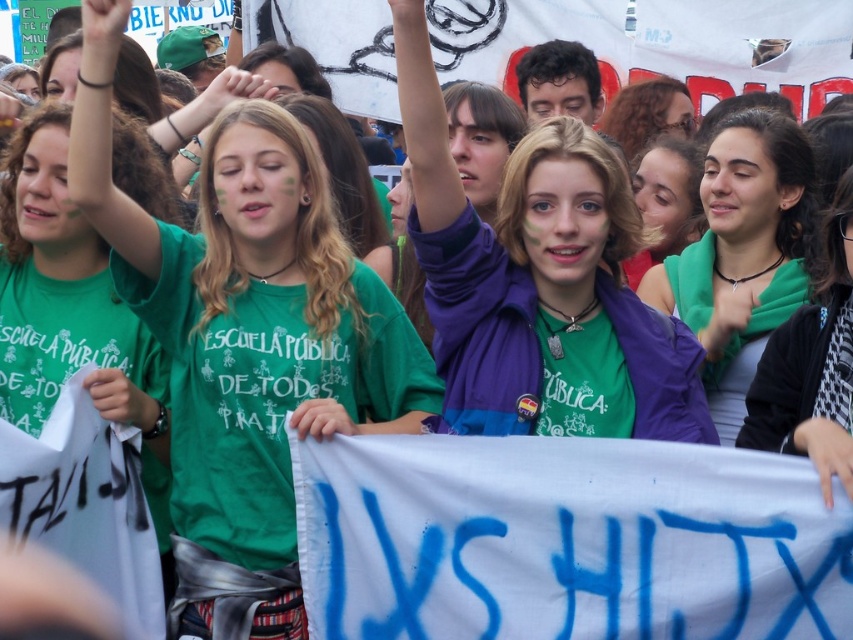
Does point (537, 253) lie behind point (747, 326)?

No, (537, 253) is closer to viewer.

Is purple fabric at center positioned at the back of green fabric scarf at center?

No, it is not.

Between point (601, 358) and point (668, 266), which one is positioned in front?

Point (601, 358) is more forward.

Find the location of a particular element. purple fabric at center is located at coordinates (532, 269).

How distant is green fabric scarf at center from blonde hair at upper center?

They are 63.12 feet apart.

Is point (647, 296) positioned behind point (665, 93)?

No.

Is point (722, 154) more distant than point (670, 113)?

No, (722, 154) is closer to viewer.

Identify the location of green fabric scarf at center. This screenshot has width=853, height=640. (741, 252).

Between green fabric scarf at center and green matte shirt at upper right, which one is positioned higher?

green fabric scarf at center

Does green fabric scarf at center have a greater width compared to green matte shirt at upper right?

Yes.

You are a GUI agent. You are given a task and a screenshot of the screen. Output one action in this format:
    pyautogui.click(x=<x>, y=<y>)
    Task: Click on the green fabric scarf at center
    
    Given the screenshot: What is the action you would take?
    pyautogui.click(x=741, y=252)